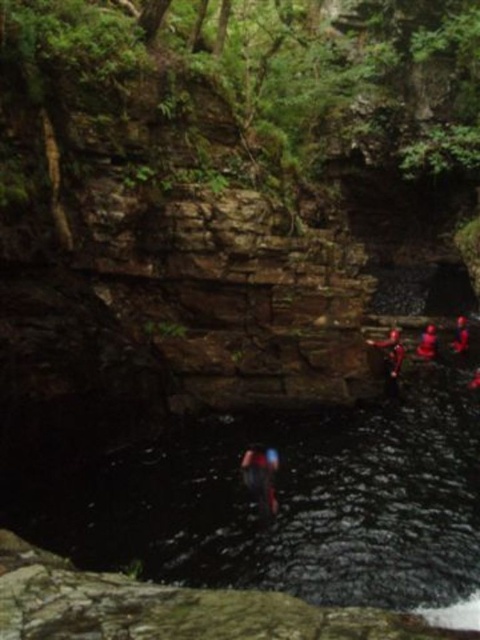
You are a hiker who wants to locate the matte red helmet at right. According to the coordinates provided, where would you look in the image?

The matte red helmet at right is located at point (427, 342) in the image.

You are a hiker who wants to know if the dark blue fabric at center is taller than the matte red helmet at right. Based on the scene description, can you determine which one is taller?

The dark blue fabric at center is not as tall as matte red helmet at right, so the matte red helmet at right is taller.